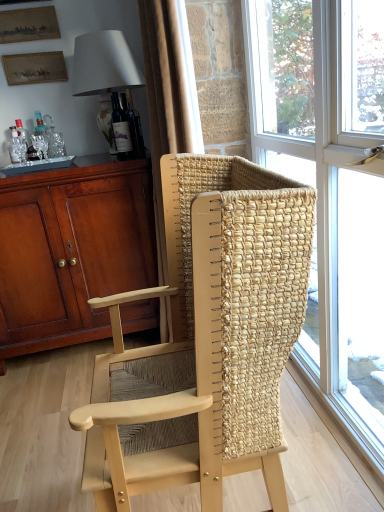
Question: Looking at their shapes, would you say matte brown cabinet at left is wider or thinner than natural wood chair at center?

Choices:
 (A) thin
 (B) wide

Answer: (B)

Question: In the image, is matte brown cabinet at left on the left side or the right side of natural wood chair at center?

Choices:
 (A) left
 (B) right

Answer: (A)

Question: Which of these objects is positioned closest to the white fabric lampshade at upper left?

Choices:
 (A) translucent glass window at center
 (B) matte glass bottle at upper center
 (C) natural wood chair at center
 (D) matte brown cabinet at left
 (E) wooden picture frame at upper left, marked as the third picture frame in a bottom-to-top arrangement

Answer: (B)

Question: Which is nearer to the wooden picture frame at upper left, the third picture frame positioned from the top?

Choices:
 (A) natural wood chair at center
 (B) white fabric lampshade at upper left
 (C) translucent glass window at center
 (D) wooden picture frame at upper left, marked as the third picture frame in a bottom-to-top arrangement
 (E) matte gold picture frame at upper left, marked as the second picture frame in a top-to-bottom arrangement

Answer: (E)